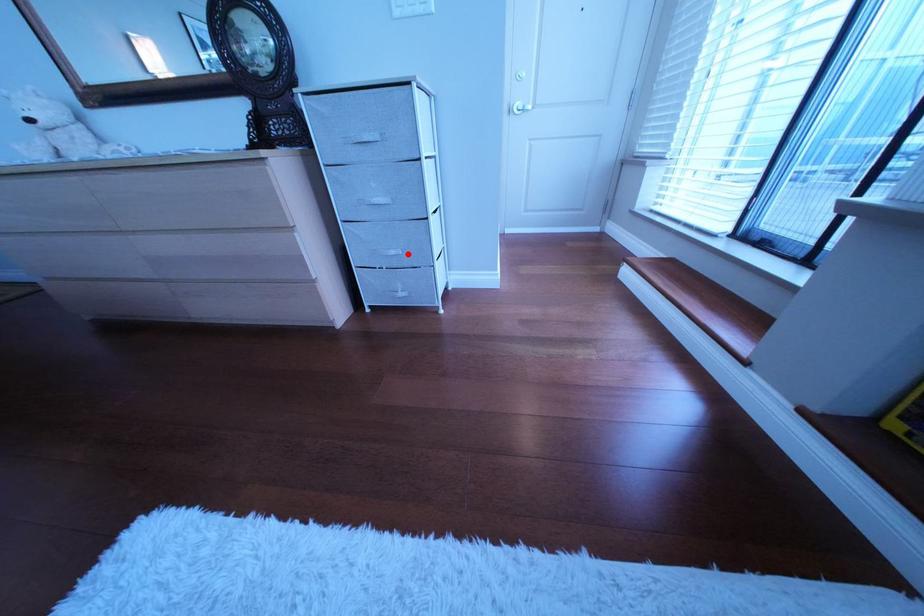
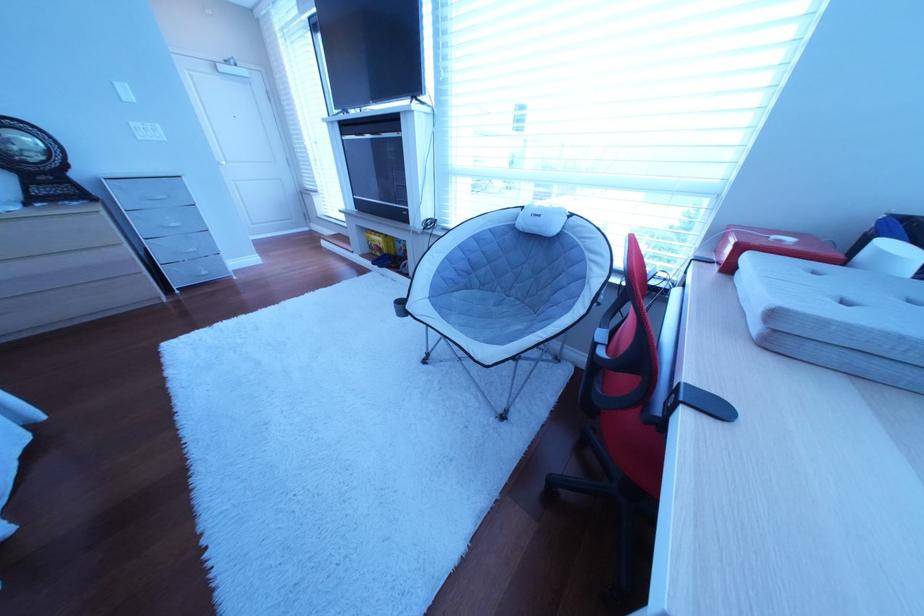
Question: I am providing you with two images of the same scene from different viewpoints. In image1, a red point is highlighted. Considering the same 3D point in image2, which of the following is correct?

Choices:
 (A) It is closer
 (B) It is farther

Answer: (A)